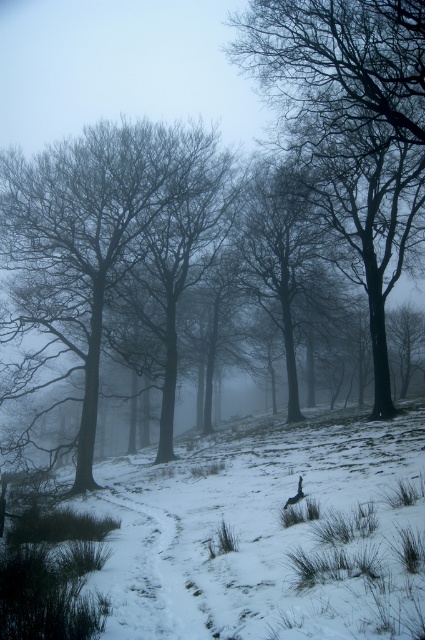
The image size is (425, 640). What do you see at coordinates (351, 129) in the screenshot?
I see `smooth bark tree at center` at bounding box center [351, 129].

Locate an element on the screen. Image resolution: width=425 pixels, height=640 pixels. smooth bark tree at center is located at coordinates (351, 129).

Who is more forward, (x=136, y=173) or (x=122, y=605)?

Point (x=122, y=605)

Who is lower down, silvery bark trees at center or snowy dirt path at center?

Positioned lower is snowy dirt path at center.

Does point (119, 170) lie behind point (169, 561)?

Yes, point (119, 170) is farther from viewer.

The image size is (425, 640). I want to click on silvery bark trees at center, so click(87, 236).

Can you confirm if silvery bark trees at center is taller than dark brown feathers at center?

Yes.

Based on the photo, can you confirm if silvery bark trees at center is thinner than dark brown feathers at center?

No, silvery bark trees at center is not thinner than dark brown feathers at center.

Does point (57, 164) come farther from viewer compared to point (297, 497)?

Yes, point (57, 164) is behind point (297, 497).

Identify the location of silvery bark trees at center. (87, 236).